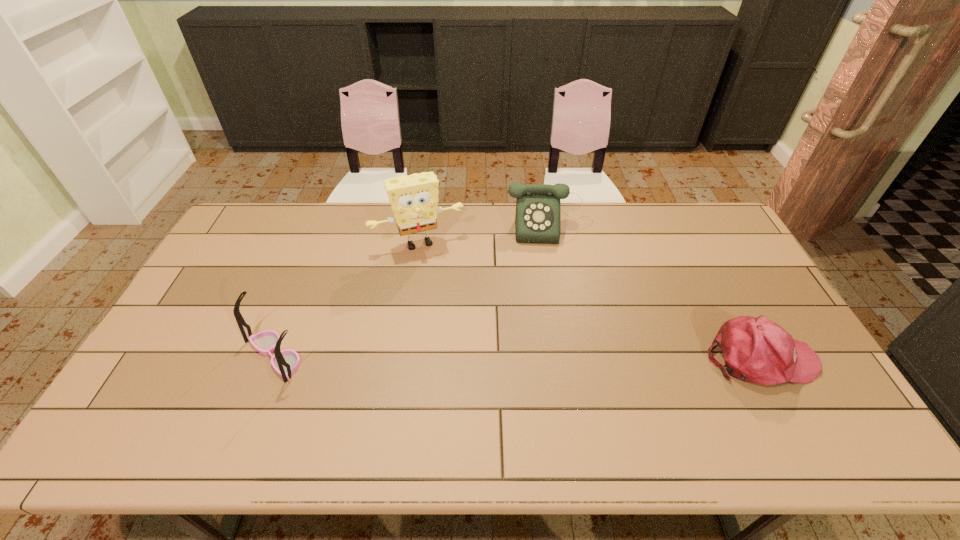
This screenshot has height=540, width=960. Find the location of `free spot at the near edge of the desktop`. free spot at the near edge of the desktop is located at coordinates (406, 383).

In order to click on vacant space at the far left corner in this screenshot , I will do `click(259, 220)`.

The width and height of the screenshot is (960, 540). In the image, there is a desktop. In order to click on free space at the near left corner in this screenshot , I will do `click(134, 411)`.

I want to click on blank space at the far right corner, so click(681, 204).

The width and height of the screenshot is (960, 540). In order to click on unoccupied area between the second object from right to left and the shortest object in this screenshot , I will do `click(656, 292)`.

The height and width of the screenshot is (540, 960). I want to click on free space between the shortest object and the telephone, so click(x=656, y=292).

Identify the location of empty space between the tallest object and the telephone. The height and width of the screenshot is (540, 960). (485, 234).

The image size is (960, 540). In order to click on empty space that is in between the leftmost object and the tallest object in this screenshot , I will do `click(348, 299)`.

Where is `free spot between the tallest object and the rightmost object`? free spot between the tallest object and the rightmost object is located at coordinates (589, 300).

Locate an element on the screen. The image size is (960, 540). vacant space that is in between the baseball cap and the telephone is located at coordinates (656, 292).